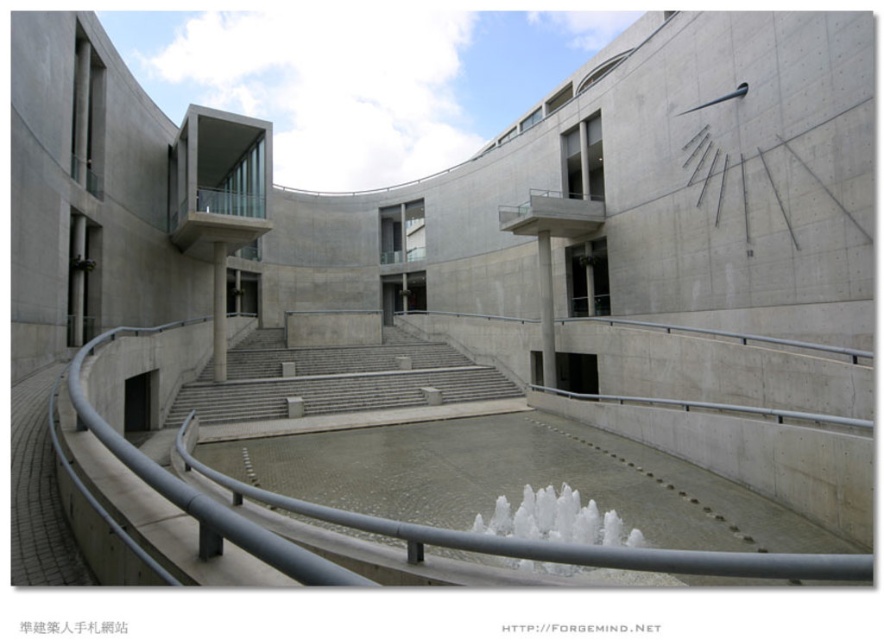
Consider the image. You are a visitor approaching the central fountain and notice the silver metallic rail at lower center and the white frothy water at center. Which object is bigger in size?

The silver metallic rail at lower center is larger in size than the white frothy water at center.